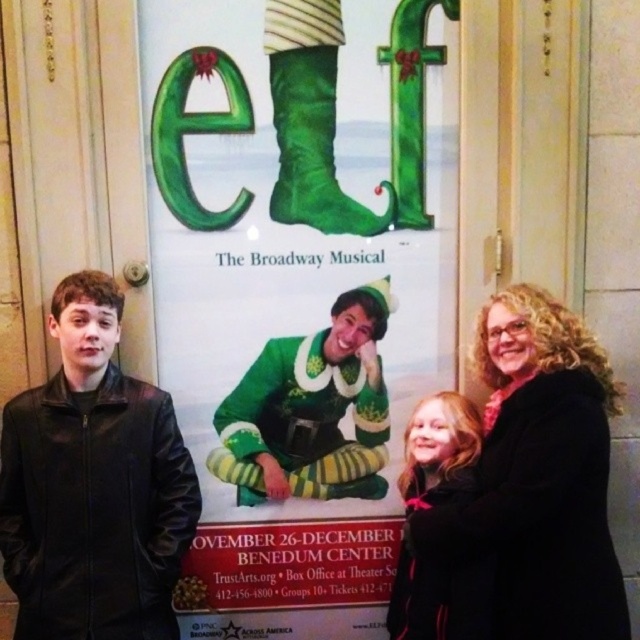
You are an event planner organizing a photo shoot in front of the Elf musical poster. You need to place a red ribbon exactly where the green fuzzy sweater at center is located. According to the coordinates provided, where should you position the ribbon?

The green fuzzy sweater at center is located at point (310,410), so you should position the red ribbon at those coordinates to match its location.

You are an assistant helping to arrange props for a theater performance. You have two green felt boots at center and a green felt boot at center. You need to place them in a line for a display. According to the image, which boot should be placed to the left?

The green felt boots at center should be placed to the left of the green felt boot at center because in the image, the green felt boots at center is positioned on the left side of green felt boot at center.

You are an event planner trying to place a decorative wreath on the wall. The green felt boots at center are currently occupying the space at point 0.450, 0.467. Can you place the wreath at that exact coordinate without overlapping the boots?

The green felt boots at center are located at point (298, 288), so placing the wreath at that exact coordinate would overlap with the boots. Choose a different spot.